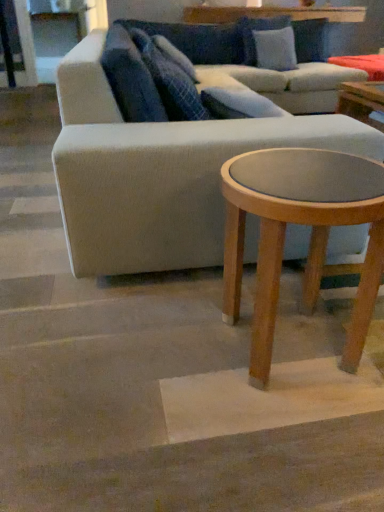
Question: Is blue textured pillow at upper center, arranged as the third pillow when viewed from the right, inside the boundaries of light blue fabric pillow at upper center, acting as the first pillow starting from the back, or outside?

Choices:
 (A) outside
 (B) inside

Answer: (A)

Question: Is blue textured pillow at upper center, placed as the 1th pillow when sorted from left to right, wider or thinner than light blue fabric pillow at upper center, the first pillow when ordered from top to bottom?

Choices:
 (A) thin
 (B) wide

Answer: (B)

Question: Considering the real-world distances, which object is closest to the blue textured pillow at upper center, acting as the 1th pillow starting from the bottom?

Choices:
 (A) light blue fabric pillow at upper center, the 3th pillow from the left
 (B) light gray fabric couch at center
 (C) blue textured pillow at upper center, the second pillow positioned from the top
 (D) light brown wood coffee table at lower right

Answer: (C)

Question: Estimate the real-world distances between objects in this image. Which object is closer to the blue textured pillow at upper center, arranged as the third pillow when viewed from the right?

Choices:
 (A) blue textured pillow at upper center, acting as the second pillow starting from the right
 (B) light gray fabric couch at center
 (C) light brown wood coffee table at lower right
 (D) light blue fabric pillow at upper center, the first pillow when ordered from top to bottom

Answer: (A)